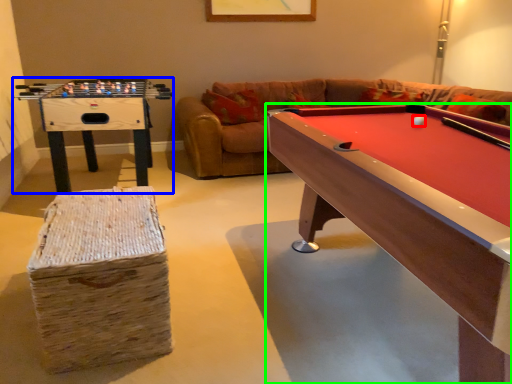
Question: Which object is positioned closest to ball (highlighted by a red box)? Select from table (highlighted by a blue box) and billiard table (highlighted by a green box).

Choices:
 (A) table
 (B) billiard table

Answer: (B)